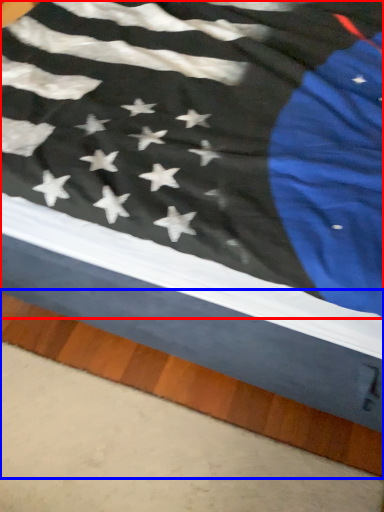
Question: Which object is closer to the camera taking this photo, flag (highlighted by a red box) or plank (highlighted by a blue box)?

Choices:
 (A) flag
 (B) plank

Answer: (A)